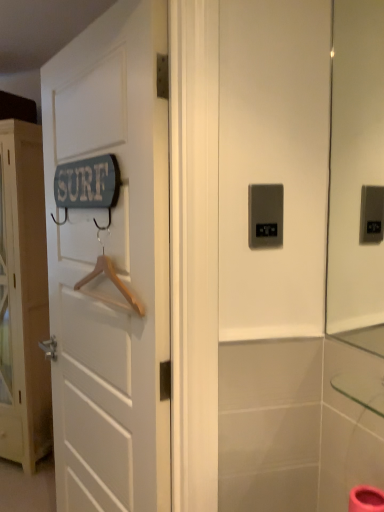
Question: Is wooden hanger at left further to camera compared to white wooden door at left, the 2th door positioned from the left?

Choices:
 (A) yes
 (B) no

Answer: (A)

Question: Can you confirm if wooden hanger at left is smaller than white wooden door at left, acting as the first door starting from the front?

Choices:
 (A) yes
 (B) no

Answer: (A)

Question: Is white wooden door at left, the 2th door positioned from the left, at the back of wooden hanger at left?

Choices:
 (A) yes
 (B) no

Answer: (A)

Question: From a real-world perspective, is wooden hanger at left below white wooden door at left, acting as the first door starting from the front?

Choices:
 (A) yes
 (B) no

Answer: (B)

Question: Is wooden hanger at left not near white wooden door at left, the 2th door positioned from the left?

Choices:
 (A) yes
 (B) no

Answer: (B)

Question: Considering the positions of satin silver panel at center and wooden hanger at left in the image, is satin silver panel at center bigger or smaller than wooden hanger at left?

Choices:
 (A) small
 (B) big

Answer: (A)

Question: Is satin silver panel at center in front of or behind wooden hanger at left in the image?

Choices:
 (A) behind
 (B) front

Answer: (B)

Question: Considering the positions of satin silver panel at center and wooden hanger at left in the image, is satin silver panel at center taller or shorter than wooden hanger at left?

Choices:
 (A) tall
 (B) short

Answer: (B)

Question: From the image's perspective, is satin silver panel at center above or below wooden hanger at left?

Choices:
 (A) above
 (B) below

Answer: (A)

Question: Considering the positions of satin silver panel at center and white wooden door at left, marked as the 1th door in a back-to-front arrangement, in the image, is satin silver panel at center bigger or smaller than white wooden door at left, marked as the 1th door in a back-to-front arrangement,?

Choices:
 (A) small
 (B) big

Answer: (A)

Question: From a real-world perspective, is satin silver panel at center physically located above or below white wooden door at left, the 2th door from the front?

Choices:
 (A) below
 (B) above

Answer: (B)

Question: From the image's perspective, is satin silver panel at center located above or below white wooden door at left, marked as the 1th door in a back-to-front arrangement?

Choices:
 (A) above
 (B) below

Answer: (A)

Question: Relative to white wooden door at left, the 2th door from the front, is satin silver panel at center in front or behind?

Choices:
 (A) behind
 (B) front

Answer: (B)

Question: From the image's perspective, is white wooden door at left, the 2th door from the front, above or below wooden hanger at left?

Choices:
 (A) above
 (B) below

Answer: (B)

Question: Considering their positions, is white wooden door at left, positioned as the 2th door in right-to-left order, located in front of or behind wooden hanger at left?

Choices:
 (A) behind
 (B) front

Answer: (A)